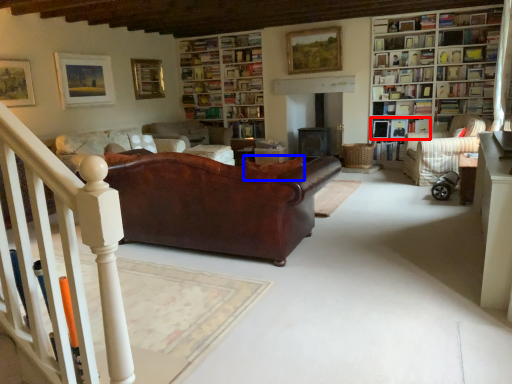
Question: Which object appears closest to the camera in this image, book (highlighted by a red box) or cushion (highlighted by a blue box)?

Choices:
 (A) book
 (B) cushion

Answer: (B)